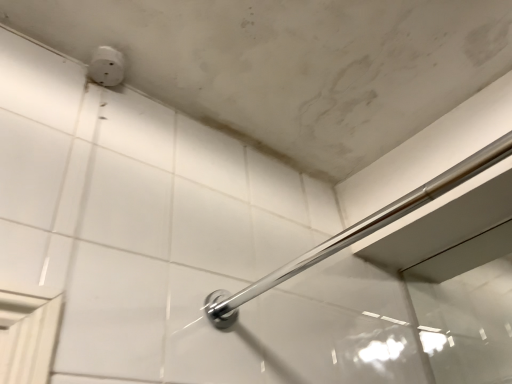
Image resolution: width=512 pixels, height=384 pixels. I want to click on polished chrome bar at upper center, so click(x=358, y=231).

Image resolution: width=512 pixels, height=384 pixels. What do you see at coordinates (358, 231) in the screenshot? I see `polished chrome bar at upper center` at bounding box center [358, 231].

Identify the location of white plastic outlet at upper left. The height and width of the screenshot is (384, 512). (106, 66).

Describe the element at coordinates (106, 66) in the screenshot. This screenshot has height=384, width=512. I see `white plastic outlet at upper left` at that location.

Looking at this image, measure the distance between white plastic outlet at upper left and camera.

white plastic outlet at upper left is 33.76 inches away from camera.

Identify the location of polished chrome bar at upper center. (358, 231).

Which object is positioned more to the right, polished chrome bar at upper center or white plastic outlet at upper left?

Positioned to the right is polished chrome bar at upper center.

Which object is further away from the camera taking this photo, polished chrome bar at upper center or white plastic outlet at upper left?

Positioned behind is white plastic outlet at upper left.

Does point (466, 170) appear closer or farther from the camera than point (100, 78)?

Point (466, 170) appears to be farther away from the viewer than point (100, 78).

From the image's perspective, between polished chrome bar at upper center and white plastic outlet at upper left, which one is located above?

white plastic outlet at upper left.

From a real-world perspective, is polished chrome bar at upper center on white plastic outlet at upper left?

No, from a real-world perspective, polished chrome bar at upper center is not on top of white plastic outlet at upper left.

Is polished chrome bar at upper center wider than white plastic outlet at upper left?

Yes, polished chrome bar at upper center is wider than white plastic outlet at upper left.

From the picture: From their relative heights in the image, would you say polished chrome bar at upper center is taller or shorter than white plastic outlet at upper left?

In the image, polished chrome bar at upper center appears to be taller than white plastic outlet at upper left.

Can you confirm if polished chrome bar at upper center is smaller than white plastic outlet at upper left?

No, polished chrome bar at upper center is not smaller than white plastic outlet at upper left.

Is polished chrome bar at upper center spatially inside white plastic outlet at upper left, or outside of it?

The correct answer is: outside.

Is polished chrome bar at upper center positioned far away from white plastic outlet at upper left?

No.

Is polished chrome bar at upper center oriented away from white plastic outlet at upper left?

No, polished chrome bar at upper center is not facing away from white plastic outlet at upper left.

Measure the distance between polished chrome bar at upper center and white plastic outlet at upper left.

They are 24.11 inches apart.

The height and width of the screenshot is (384, 512). I want to click on door handle that appears below the white plastic outlet at upper left (from the image's perspective), so click(358, 231).

Can you confirm if white plastic outlet at upper left is positioned to the left of polished chrome bar at upper center?

Correct, you'll find white plastic outlet at upper left to the left of polished chrome bar at upper center.

Considering the positions of objects white plastic outlet at upper left and polished chrome bar at upper center in the image provided, who is in front, white plastic outlet at upper left or polished chrome bar at upper center?

Positioned in front is polished chrome bar at upper center.

Is point (104, 81) in front of point (259, 292)?

No.

From the image's perspective, between white plastic outlet at upper left and polished chrome bar at upper center, which one is located above?

white plastic outlet at upper left appears higher in the image.

From a real-world perspective, which object stands above the other?

white plastic outlet at upper left.

Considering the sizes of objects white plastic outlet at upper left and polished chrome bar at upper center in the image provided, who is wider, white plastic outlet at upper left or polished chrome bar at upper center?

Wider between the two is polished chrome bar at upper center.

Can you confirm if white plastic outlet at upper left is taller than polished chrome bar at upper center?

In fact, white plastic outlet at upper left may be shorter than polished chrome bar at upper center.

Which of these two, white plastic outlet at upper left or polished chrome bar at upper center, is bigger?

With larger size is polished chrome bar at upper center.

Based on the photo, can we say white plastic outlet at upper left lies outside polished chrome bar at upper center?

Yes, white plastic outlet at upper left is located beyond the bounds of polished chrome bar at upper center.

Would you consider white plastic outlet at upper left to be distant from polished chrome bar at upper center?

white plastic outlet at upper left is actually quite close to polished chrome bar at upper center.

Could you tell me if white plastic outlet at upper left is turned towards polished chrome bar at upper center?

No, white plastic outlet at upper left does not turn towards polished chrome bar at upper center.

How many degrees apart are the facing directions of white plastic outlet at upper left and polished chrome bar at upper center?

The angular difference between white plastic outlet at upper left and polished chrome bar at upper center is 92.4 degrees.

Locate an element on the screen. electric outlet above the polished chrome bar at upper center (from the image's perspective) is located at coordinates (x=106, y=66).

Find the location of a particular element. The image size is (512, 384). door handle below the white plastic outlet at upper left (from a real-world perspective) is located at coordinates (358, 231).

This screenshot has height=384, width=512. I want to click on electric outlet lying on the left of polished chrome bar at upper center, so click(x=106, y=66).